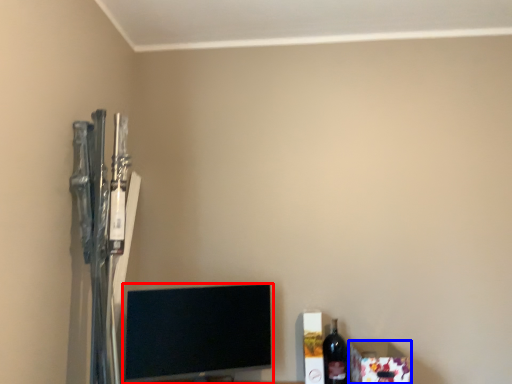
Question: Which object is further to the camera taking this photo, television (highlighted by a red box) or box (highlighted by a blue box)?

Choices:
 (A) television
 (B) box

Answer: (B)